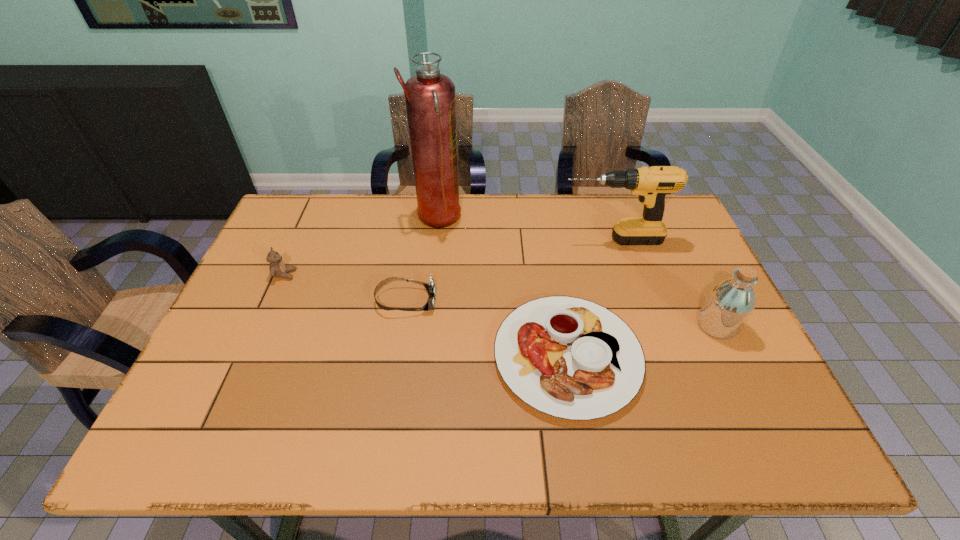
At what (x,y) coordinates should I click in order to perform the action: click on free spot located at the tip of the drill. Please return your answer as a coordinate pair (x, y). Image resolution: width=960 pixels, height=540 pixels. Looking at the image, I should click on (455, 240).

The image size is (960, 540). Find the location of `free space located on the left of the fourth shortest object`. free space located on the left of the fourth shortest object is located at coordinates (618, 326).

Find the location of a particular element. The width and height of the screenshot is (960, 540). free spot located on the front-facing side of the teddy bear is located at coordinates (369, 275).

Where is `free space located 0.260m on the front-facing side of the goggles`? The height and width of the screenshot is (540, 960). free space located 0.260m on the front-facing side of the goggles is located at coordinates (532, 301).

You are a GUI agent. You are given a task and a screenshot of the screen. Output one action in this format:
    pyautogui.click(x=<x>, y=<y>)
    Task: Click on the free space located on the right of the shortest object
    
    Given the screenshot: What is the action you would take?
    pyautogui.click(x=666, y=356)

This screenshot has height=540, width=960. Identify the location of fire extinguisher that is at the far edge. (430, 101).

What are the coordinates of `drill that is at the far edge` in the screenshot? It's located at (652, 184).

At what (x,y) coordinates should I click in order to perform the action: click on object located in the near edge section of the desktop. Please return your answer as a coordinate pair (x, y). Looking at the image, I should click on (571, 358).

Locate an element on the screen. object present at the left edge is located at coordinates (277, 268).

In order to click on drill that is positioned at the right edge in this screenshot , I will do `click(652, 184)`.